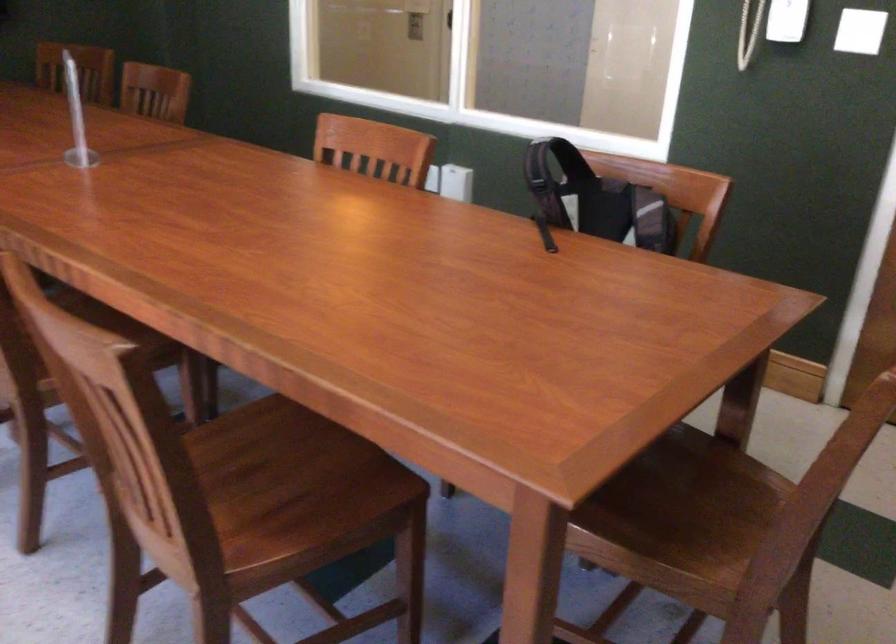
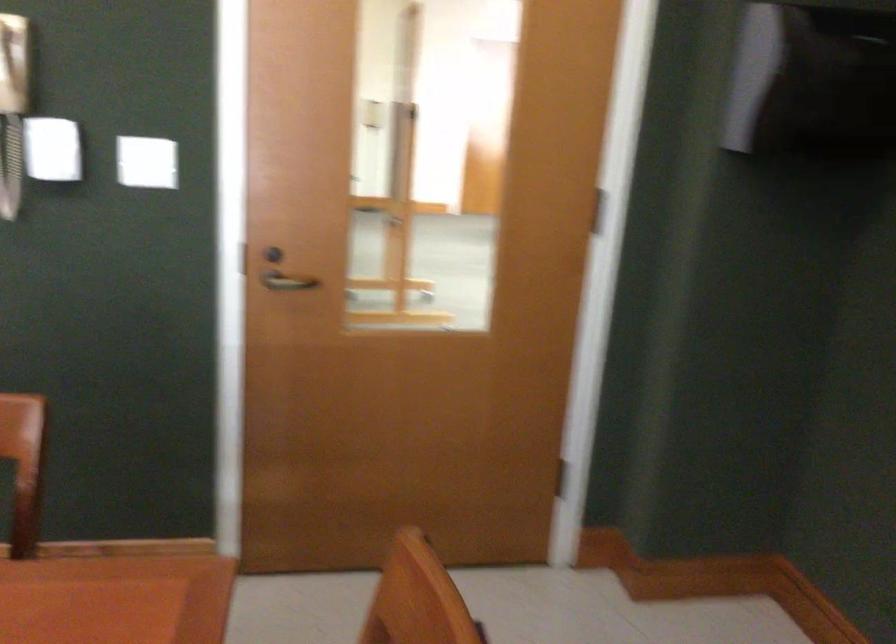
Question: The camera is either moving clockwise (left) or counter-clockwise (right) around the object. The first image is from the beginning of the video and the second image is from the end. Is the camera moving left or right when shooting the video?

Choices:
 (A) Left
 (B) Right

Answer: (A)